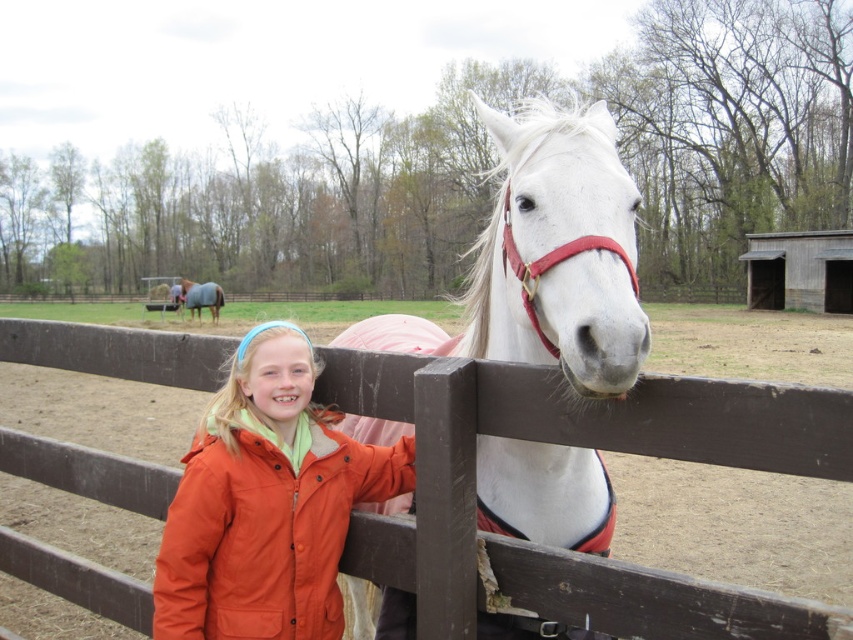
Question: Among these objects, which one is nearest to the camera?

Choices:
 (A) orange matte jacket at lower left
 (B) white glossy horse at center

Answer: (B)

Question: Which point is farther to the camera?

Choices:
 (A) brown wooden fence at center
 (B) gray felt blanket at upper left
 (C) white glossy horse at center

Answer: (B)

Question: Is brown wooden fence at center thinner than gray felt blanket at upper left?

Choices:
 (A) no
 (B) yes

Answer: (B)

Question: Is brown wooden fence at center smaller than gray felt blanket at upper left?

Choices:
 (A) yes
 (B) no

Answer: (A)

Question: In this image, where is brown wooden fence at center located relative to white glossy horse at center?

Choices:
 (A) left
 (B) right

Answer: (B)

Question: Based on their relative distances, which object is nearer to the gray felt blanket at upper left?

Choices:
 (A) white glossy horse at center
 (B) orange matte jacket at lower left
 (C) brown wooden fence at center

Answer: (A)